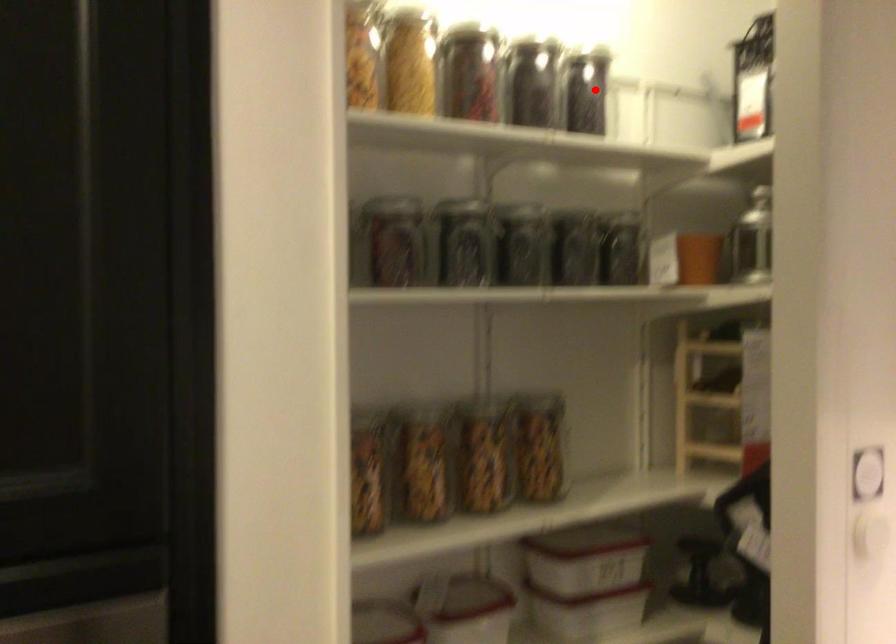
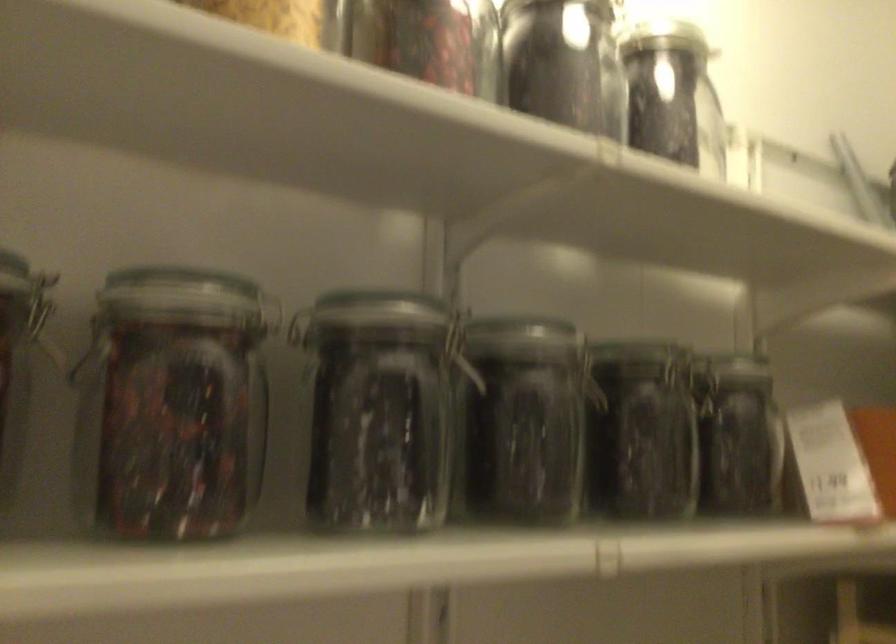
In the second image, find the point that corresponds to the highlighted location in the first image.

(673, 95)